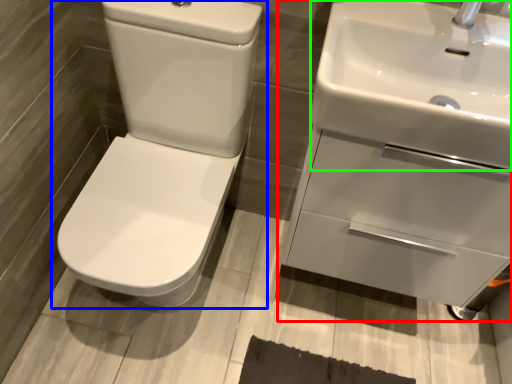
Question: Considering the real-world distances, which object is closest to sink (highlighted by a red box)? toilet (highlighted by a blue box) or sink (highlighted by a green box).

Choices:
 (A) toilet
 (B) sink

Answer: (B)